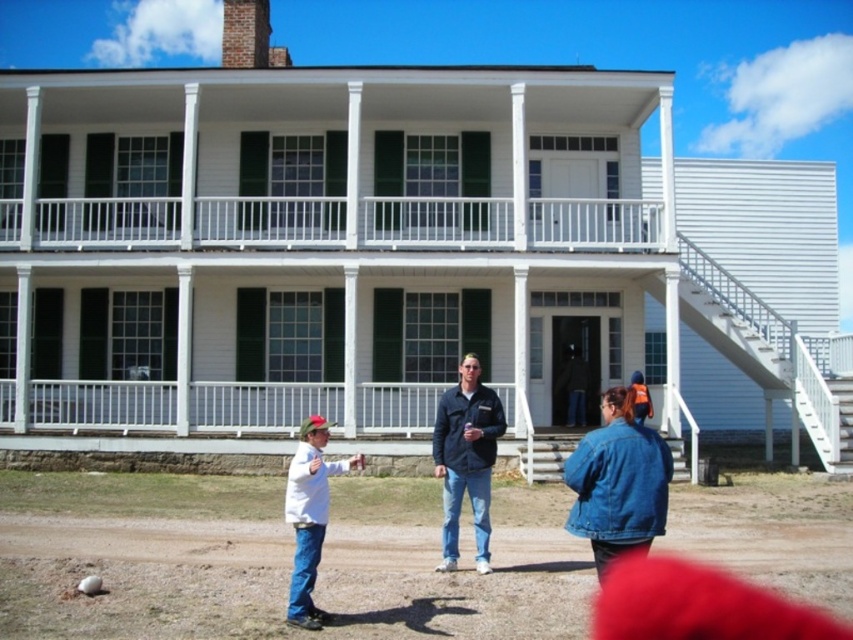
You are a photographer trying to capture a group photo of the dark blue jacket at center and the white matte shirt at lower left. Since you want to ensure both subjects are in focus, you need to know which one is bigger. Which one is larger?

The dark blue jacket at center is larger in size than the white matte shirt at lower left, so you should focus on the dark blue jacket at center first as it requires more attention due to its larger size.

You are standing on the dirt ground near the white matte shirt at lower left and want to walk to the entrance of the building. Can you walk directly to the entrance without going under the white painted wood porch at upper center?

The white painted wood porch at upper center is positioned over the white matte shirt at lower left, so you would need to walk under the porch to reach the entrance.

You are standing on the dirt ground near the white matte shirt at lower left and want to walk towards the entrance of the building. Which direction should you walk to avoid the white painted wood porch at upper center?

To avoid the white painted wood porch at upper center, you should walk to the right since the white painted wood porch at upper center is to the left of the white matte shirt at lower left.